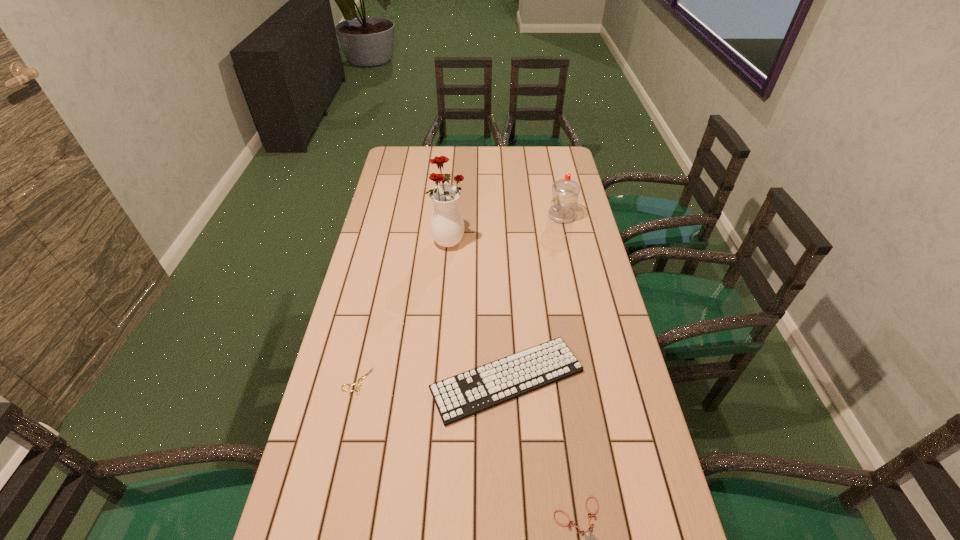
Where is `vacant area that lies between the vase and the third shortest object`? vacant area that lies between the vase and the third shortest object is located at coordinates (478, 309).

At what (x,y) coordinates should I click in order to perform the action: click on free space between the third tallest object and the farthest object. Please return your answer as a coordinate pair (x, y). Looking at the image, I should click on (535, 298).

Where is `vacant space in between the vase and the farthest object`? vacant space in between the vase and the farthest object is located at coordinates (505, 228).

In order to click on object that is the third nearest to the third tallest object in this screenshot , I will do `click(447, 225)`.

The width and height of the screenshot is (960, 540). Identify the location of object that ranks as the closest to the farthest object. (447, 225).

Identify which shears is the second closest to the third shortest object. Please provide its 2D coordinates. Your answer should be formatted as a tuple, i.e. [(x, y)], where the tuple contains the x and y coordinates of a point satisfying the conditions above.

[(590, 539)]

I want to click on the second closest shears to the vase, so click(x=590, y=539).